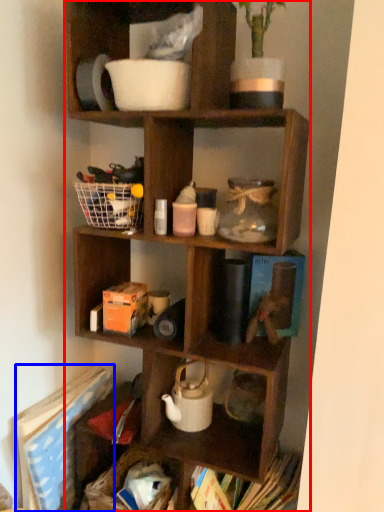
Question: Which point is closer to the camera, shelf (highlighted by a red box) or book (highlighted by a blue box)?

Choices:
 (A) shelf
 (B) book

Answer: (A)